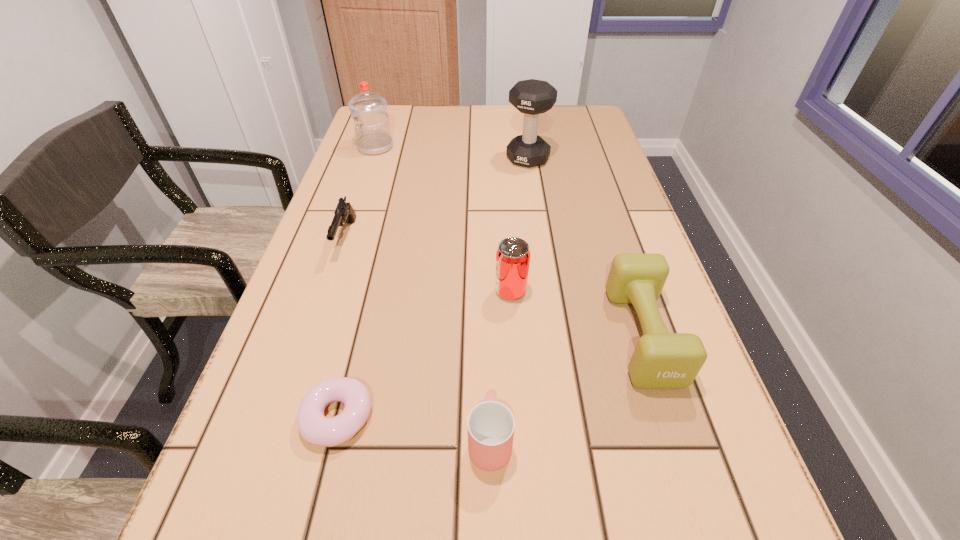
Locate an element on the screen. Image resolution: width=960 pixels, height=540 pixels. vacant area in the image that satisfies the following two spatial constraints: 1. on the handle side of the right dumbbell; 2. on the left side of the water bottle is located at coordinates click(312, 335).

You are a GUI agent. You are given a task and a screenshot of the screen. Output one action in this format:
    pyautogui.click(x=<x>, y=<y>)
    Task: Click on the free region that satisfies the following two spatial constraints: 1. on the handle side of the water bottle; 2. on the back side of the taller dumbbell
    The image size is (960, 540).
    Given the screenshot: What is the action you would take?
    pyautogui.click(x=372, y=159)

Where is `free spot that satisfies the following two spatial constraints: 1. on the side of the cup with the handle; 2. on the handle side of the water bottle`? free spot that satisfies the following two spatial constraints: 1. on the side of the cup with the handle; 2. on the handle side of the water bottle is located at coordinates (485, 147).

This screenshot has height=540, width=960. Find the location of `vacant space that satisfies the following two spatial constraints: 1. on the side of the cup with the handle; 2. on the left side of the nearer dumbbell`. vacant space that satisfies the following two spatial constraints: 1. on the side of the cup with the handle; 2. on the left side of the nearer dumbbell is located at coordinates pos(489,335).

Image resolution: width=960 pixels, height=540 pixels. In order to click on vacant space that satisfies the following two spatial constraints: 1. at the end of the barrel of the fifth nearest object; 2. on the left side of the nearer dumbbell in this screenshot , I will do `click(314, 335)`.

This screenshot has width=960, height=540. I want to click on free space that satisfies the following two spatial constraints: 1. on the side of the rightmost object with the handle; 2. on the left side of the cup, so click(x=489, y=335).

Where is `vacant space that satisfies the following two spatial constraints: 1. on the handle side of the left dumbbell; 2. on the right side of the water bottle`? This screenshot has height=540, width=960. vacant space that satisfies the following two spatial constraints: 1. on the handle side of the left dumbbell; 2. on the right side of the water bottle is located at coordinates [x=372, y=159].